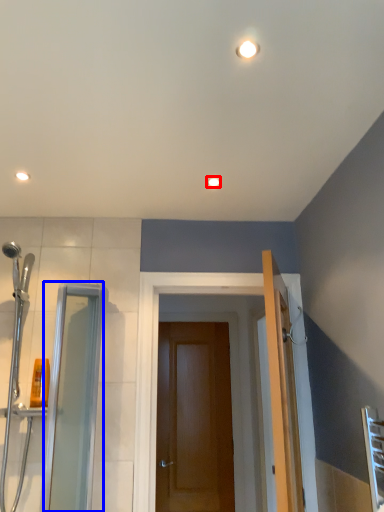
Question: Which object is closer to the camera taking this photo, light fixture (highlighted by a red box) or screen door (highlighted by a blue box)?

Choices:
 (A) light fixture
 (B) screen door

Answer: (B)